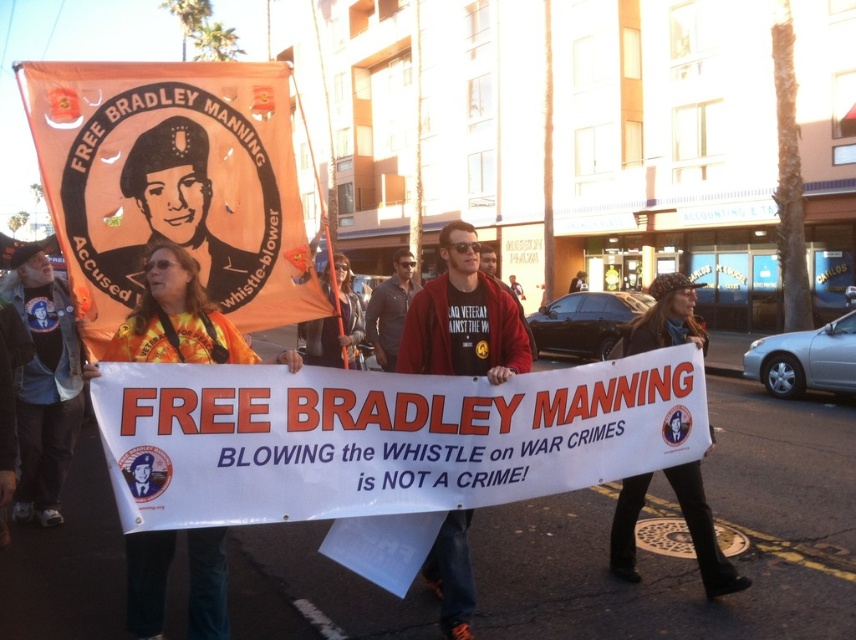
Does orange fabric banner at upper left have a smaller size compared to matte gray shirt at center?

Incorrect, orange fabric banner at upper left is not smaller in size than matte gray shirt at center.

Is orange fabric banner at upper left bigger than matte gray shirt at center?

Yes.

The width and height of the screenshot is (856, 640). What do you see at coordinates (171, 182) in the screenshot?
I see `orange fabric banner at upper left` at bounding box center [171, 182].

Image resolution: width=856 pixels, height=640 pixels. In order to click on orange fabric banner at upper left in this screenshot , I will do `click(171, 182)`.

Does red fleece jacket at center have a greater height compared to matte gray shirt at center?

No, red fleece jacket at center is not taller than matte gray shirt at center.

What are the coordinates of `red fleece jacket at center` in the screenshot? It's located at (464, 317).

Does orange fabric banner at upper left have a smaller size compared to denim jacket at left?

Indeed, orange fabric banner at upper left has a smaller size compared to denim jacket at left.

Describe the element at coordinates (171, 182) in the screenshot. I see `orange fabric banner at upper left` at that location.

Identify the location of orange fabric banner at upper left. (171, 182).